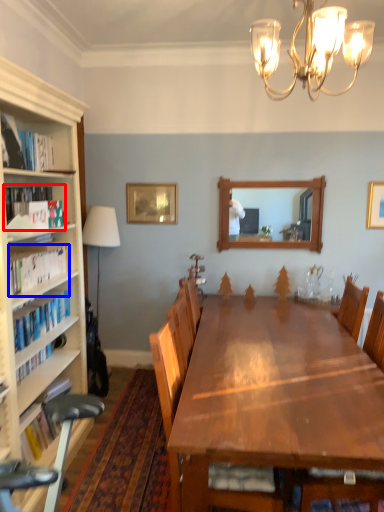
Question: Which object is closer to the camera taking this photo, book (highlighted by a red box) or book (highlighted by a blue box)?

Choices:
 (A) book
 (B) book

Answer: (B)